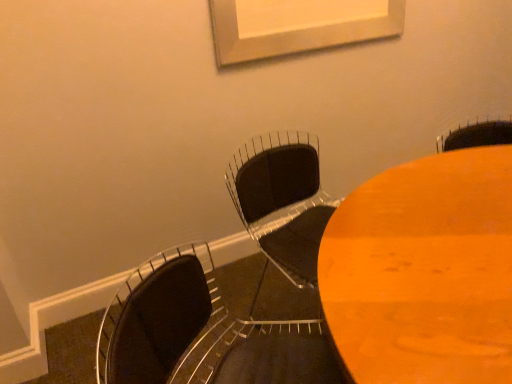
You are a GUI agent. You are given a task and a screenshot of the screen. Output one action in this format:
    pyautogui.click(x=<x>, y=<y>)
    Task: Click on the wooden table at center
    This screenshot has height=384, width=512.
    Given the screenshot: What is the action you would take?
    pyautogui.click(x=424, y=272)

How different are the orientations of wooden table at center and matte black chair at lower left, the 2th chair viewed from the back, in degrees?

57.7 degrees.

From the image's perspective, which is above, wooden table at center or matte black chair at lower left, the 1th chair in the front-to-back sequence?

wooden table at center appears higher in the image.

Is point (370, 193) behind point (124, 370)?

Yes, point (370, 193) is farther from viewer.

Are wooden table at center and matte black chair at lower left, the 1th chair in the front-to-back sequence, making contact?

No.

Is point (330, 366) closer to camera compared to point (295, 241)?

Yes, point (330, 366) is closer to viewer.

Does matte black chair at lower left, the 1th chair in the front-to-back sequence, touch black matte chair at center, positioned as the 2th chair in front-to-back order?

No, matte black chair at lower left, the 1th chair in the front-to-back sequence, is not with black matte chair at center, positioned as the 2th chair in front-to-back order.

In the image, is matte black chair at lower left, the 2th chair viewed from the back, positioned in front of or behind black matte chair at center, positioned as the 2th chair in front-to-back order?

matte black chair at lower left, the 2th chair viewed from the back, is in front of black matte chair at center, positioned as the 2th chair in front-to-back order.

Is point (106, 357) less distant than point (372, 373)?

That is False.

From a real-world perspective, which object rests below the other?

wooden table at center, from a real-world perspective.

How far apart are matte black chair at lower left, the 2th chair viewed from the back, and wooden table at center?

They are 15.63 inches apart.

Which object is closer to the camera, matte black chair at lower left, the 1th chair in the front-to-back sequence, or wooden table at center?

matte black chair at lower left, the 1th chair in the front-to-back sequence, is in front.

Which object is positioned more to the right, black matte chair at center, positioned as the first chair in back-to-front order, or matte black chair at lower left, the 1th chair in the front-to-back sequence?

black matte chair at center, positioned as the first chair in back-to-front order.

Does black matte chair at center, positioned as the first chair in back-to-front order, have a lesser width compared to matte black chair at lower left, the 2th chair viewed from the back?

Yes, black matte chair at center, positioned as the first chair in back-to-front order, is thinner than matte black chair at lower left, the 2th chair viewed from the back.

From a real-world perspective, relative to matte black chair at lower left, the 2th chair viewed from the back, is black matte chair at center, positioned as the 2th chair in front-to-back order, vertically above or below?

black matte chair at center, positioned as the 2th chair in front-to-back order, is below matte black chair at lower left, the 2th chair viewed from the back.

Which object is wider, wooden table at center or black matte chair at center, positioned as the 2th chair in front-to-back order?

wooden table at center.

In the scene shown: Is wooden table at center behind black matte chair at center, positioned as the first chair in back-to-front order?

No, wooden table at center is closer to the viewer.

Image resolution: width=512 pixels, height=384 pixels. In order to click on table that appears below the black matte chair at center, positioned as the 2th chair in front-to-back order (from a real-world perspective) in this screenshot , I will do `click(424, 272)`.

Is wooden table at center completely or partially outside of black matte chair at center, positioned as the 2th chair in front-to-back order?

wooden table at center lies outside black matte chair at center, positioned as the 2th chair in front-to-back order,'s area.

The image size is (512, 384). I want to click on chair behind the wooden table at center, so click(x=282, y=200).

Is black matte chair at center, positioned as the 2th chair in front-to-back order, completely or partially outside of wooden table at center?

Absolutely, black matte chair at center, positioned as the 2th chair in front-to-back order, is external to wooden table at center.

Identify the location of table that appears behind the matte black chair at lower left, the 2th chair viewed from the back. Image resolution: width=512 pixels, height=384 pixels. (424, 272).

I want to click on chair lying on the right of matte black chair at lower left, the 2th chair viewed from the back, so click(282, 200).

From the picture: Considering their positions, is black matte chair at center, positioned as the first chair in back-to-front order, positioned closer to matte black chair at lower left, the 2th chair viewed from the back, than wooden table at center?

wooden table at center is closer to matte black chair at lower left, the 2th chair viewed from the back.

Looking at this image, looking at the image, which one is located further to black matte chair at center, positioned as the 2th chair in front-to-back order, matte black chair at lower left, the 1th chair in the front-to-back sequence, or wooden table at center?

Among the two, matte black chair at lower left, the 1th chair in the front-to-back sequence, is located further to black matte chair at center, positioned as the 2th chair in front-to-back order.

Which object lies nearer to the anchor point wooden table at center, matte black chair at lower left, the 1th chair in the front-to-back sequence, or black matte chair at center, positioned as the first chair in back-to-front order?

matte black chair at lower left, the 1th chair in the front-to-back sequence, is closer to wooden table at center.

Looking at this image, considering their positions, is wooden table at center positioned closer to matte black chair at lower left, the 2th chair viewed from the back, than black matte chair at center, positioned as the 2th chair in front-to-back order?

wooden table at center lies closer to matte black chair at lower left, the 2th chair viewed from the back, than the other object.

Estimate the real-world distances between objects in this image. Which object is further from black matte chair at center, positioned as the first chair in back-to-front order, wooden table at center or matte black chair at lower left, the 2th chair viewed from the back?

The object further to black matte chair at center, positioned as the first chair in back-to-front order, is matte black chair at lower left, the 2th chair viewed from the back.

Estimate the real-world distances between objects in this image. Which object is further from wooden table at center, black matte chair at center, positioned as the first chair in back-to-front order, or matte black chair at lower left, the 1th chair in the front-to-back sequence?

The object further to wooden table at center is black matte chair at center, positioned as the first chair in back-to-front order.

What are the coordinates of `chair between matte black chair at lower left, the 1th chair in the front-to-back sequence, and wooden table at center from left to right` in the screenshot? It's located at (282, 200).